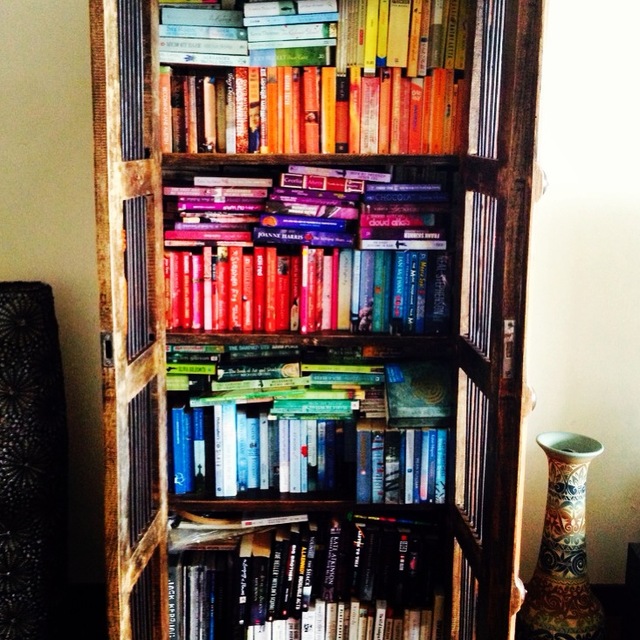
The width and height of the screenshot is (640, 640). I want to click on top of vase, so click(x=576, y=444).